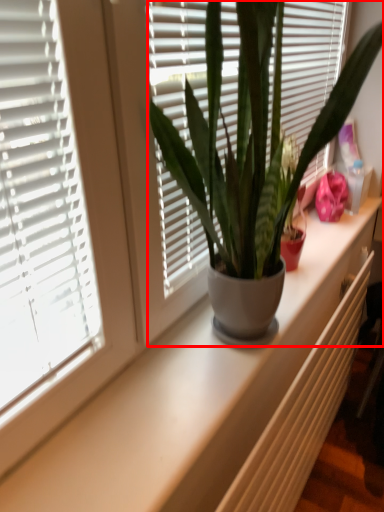
Question: Where is houseplant (annotated by the red box) located in relation to radiator in the image?

Choices:
 (A) right
 (B) left

Answer: (B)